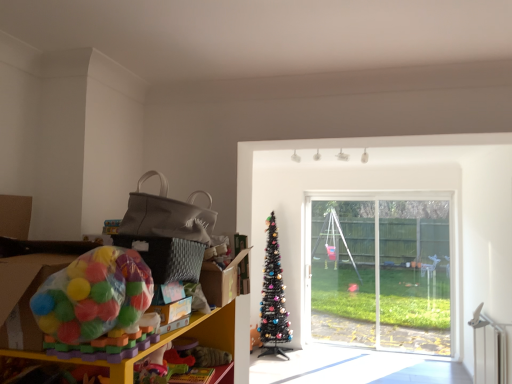
Question: From the image's perspective, is black artificial christmas tree at center located above transparent glass window at center?

Choices:
 (A) no
 (B) yes

Answer: (A)

Question: From the image's perspective, is black artificial christmas tree at center beneath transparent glass window at center?

Choices:
 (A) no
 (B) yes

Answer: (B)

Question: Does black artificial christmas tree at center appear on the right side of transparent glass window at center?

Choices:
 (A) no
 (B) yes

Answer: (A)

Question: Is black artificial christmas tree at center to the left of transparent glass window at center from the viewer's perspective?

Choices:
 (A) no
 (B) yes

Answer: (B)

Question: Is black artificial christmas tree at center far away from transparent glass window at center?

Choices:
 (A) no
 (B) yes

Answer: (B)

Question: From the image's perspective, is plastic toy at left located above or below black artificial christmas tree at center?

Choices:
 (A) below
 (B) above

Answer: (B)

Question: From a real-world perspective, relative to black artificial christmas tree at center, is plastic toy at left vertically above or below?

Choices:
 (A) above
 (B) below

Answer: (A)

Question: Based on their sizes in the image, would you say plastic toy at left is bigger or smaller than black artificial christmas tree at center?

Choices:
 (A) big
 (B) small

Answer: (A)

Question: Is plastic toy at left in front of or behind black artificial christmas tree at center in the image?

Choices:
 (A) behind
 (B) front

Answer: (B)

Question: Is plastic toy at left spatially inside translucent plastic ball pit at left, or outside of it?

Choices:
 (A) outside
 (B) inside

Answer: (A)

Question: Considering the positions of point (227, 314) and point (150, 281), is point (227, 314) closer or farther from the camera than point (150, 281)?

Choices:
 (A) farther
 (B) closer

Answer: (A)

Question: Is plastic toy at left bigger or smaller than translucent plastic ball pit at left?

Choices:
 (A) big
 (B) small

Answer: (A)

Question: From the image's perspective, is plastic toy at left located above or below translucent plastic ball pit at left?

Choices:
 (A) above
 (B) below

Answer: (B)

Question: Is translucent plastic ball pit at left inside the boundaries of plastic toy at left, or outside?

Choices:
 (A) inside
 (B) outside

Answer: (B)

Question: Considering the positions of translucent plastic ball pit at left and plastic toy at left in the image, is translucent plastic ball pit at left wider or thinner than plastic toy at left?

Choices:
 (A) wide
 (B) thin

Answer: (B)